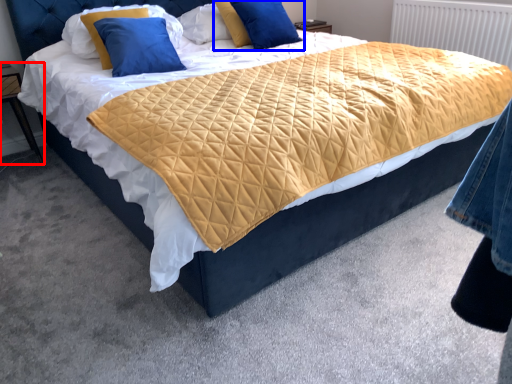
Question: Which object is closer to the camera taking this photo, nightstand (highlighted by a red box) or pillow (highlighted by a blue box)?

Choices:
 (A) nightstand
 (B) pillow

Answer: (A)